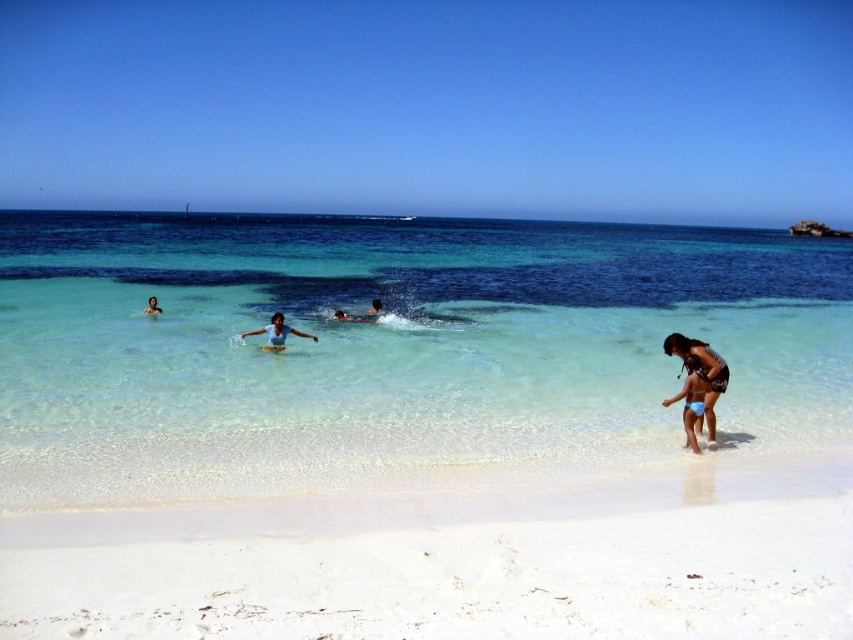
You are standing on the pristine white sandy beach in the foreground and want to join the smooth skin person at center who is wading in the shallow turquoise waters. Based on their position, which direction should you walk from the shoreline to reach them?

The smooth skin person at center is located at point coordinates, so you should walk directly towards the center of the beach from the shoreline to reach them.

You are a photographer on the beach and want to capture both the matte black bikini at lower right and the matte blue swimsuit at center in a single shot. Which swimwear should you focus on first to ensure both are in frame?

The matte black bikini at lower right is located below the matte blue swimsuit at center, so you should focus on the matte blue swimsuit at center first to ensure both are in frame.

You are a photographer on the beach and want to capture both the matte black bikini at lower right and the matte blue swimsuit at center in a single shot. Which swimwear is closer to the right edge of the frame?

The matte black bikini at lower right is positioned on the right side of the matte blue swimsuit at center, so it is closer to the right edge of the frame.